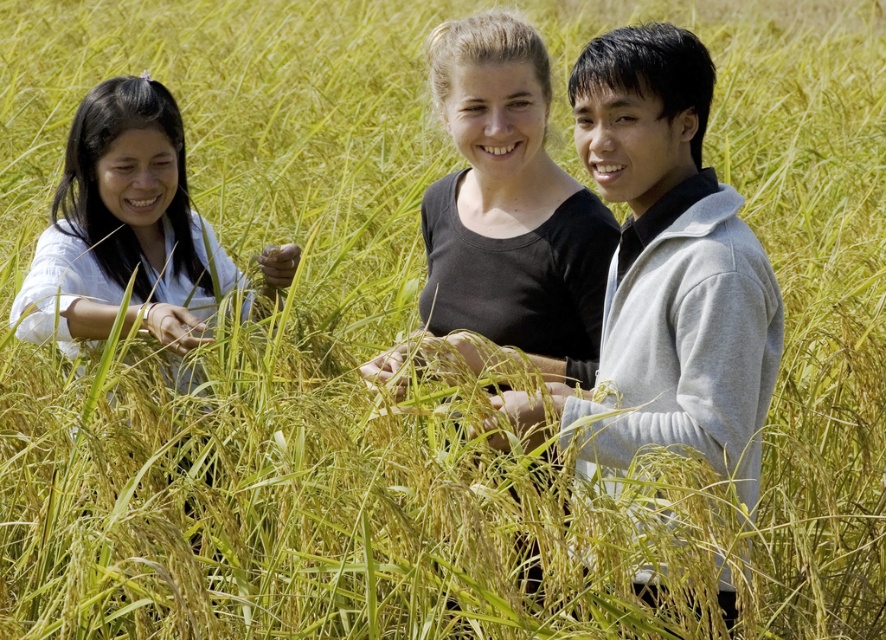
You are standing in a field of tall rice plants and see the black matte shirt at center and the light blue fabric at left. Which one appears nearer to you?

The black matte shirt at center is closer to the viewer than the light blue fabric at left.

You are trying to decide which clothing item to take with you for a hike. You see the gray fleece jacket at center and the black matte shirt at center in the image. Based on their sizes, which one might be more suitable for packing into a small backpack?

The gray fleece jacket at center has a lesser width compared to the black matte shirt at center, so it might be more suitable for packing into a small backpack since it takes up less space.

You are a photographer trying to capture a group photo of the gray fleece jacket at center and the black matte shirt at center. Based on their heights, which one should you position closer to the front to ensure both are visible in the photo?

The gray fleece jacket at center is much taller than the black matte shirt at center. To ensure both are visible, position the gray fleece jacket at center at the back and the black matte shirt at center at the front.